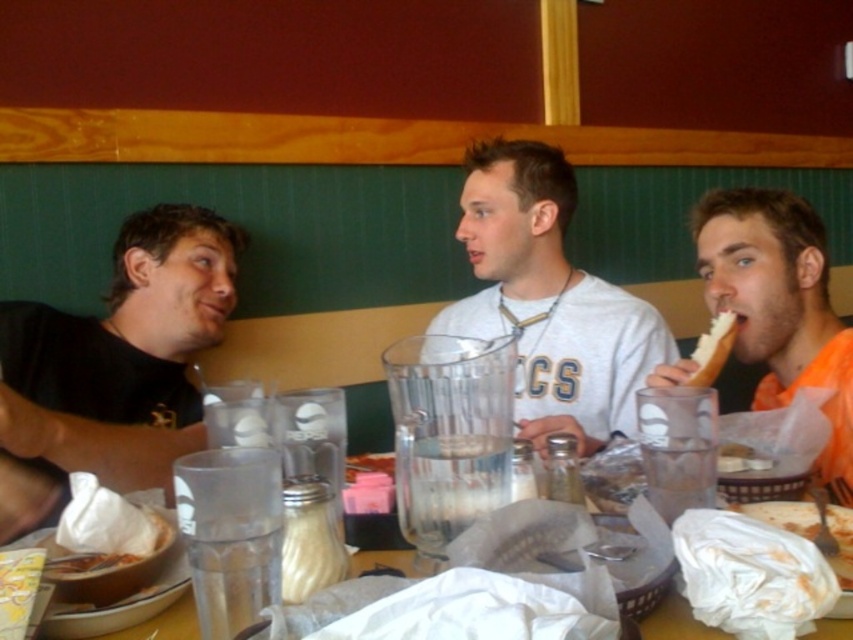
Question: Is orange matte shirt at right thinner than white paper sandwich at center?

Choices:
 (A) yes
 (B) no

Answer: (B)

Question: Is orange matte shirt at right to the right of white paper sandwich at center from the viewer's perspective?

Choices:
 (A) yes
 (B) no

Answer: (A)

Question: Among these objects, which one is nearest to the camera?

Choices:
 (A) white bread at right
 (B) white matte shirt at center

Answer: (B)

Question: Can you confirm if white paper sandwich at center is positioned below white bread at right?

Choices:
 (A) yes
 (B) no

Answer: (A)

Question: Which object is the closest to the white bread at right?

Choices:
 (A) clear plastic cups at center
 (B) matte black shirt at left

Answer: (A)

Question: Which object is positioned closest to the matte black shirt at left?

Choices:
 (A) white bread at right
 (B) white paper sandwich at center
 (C) clear plastic cups at center

Answer: (C)